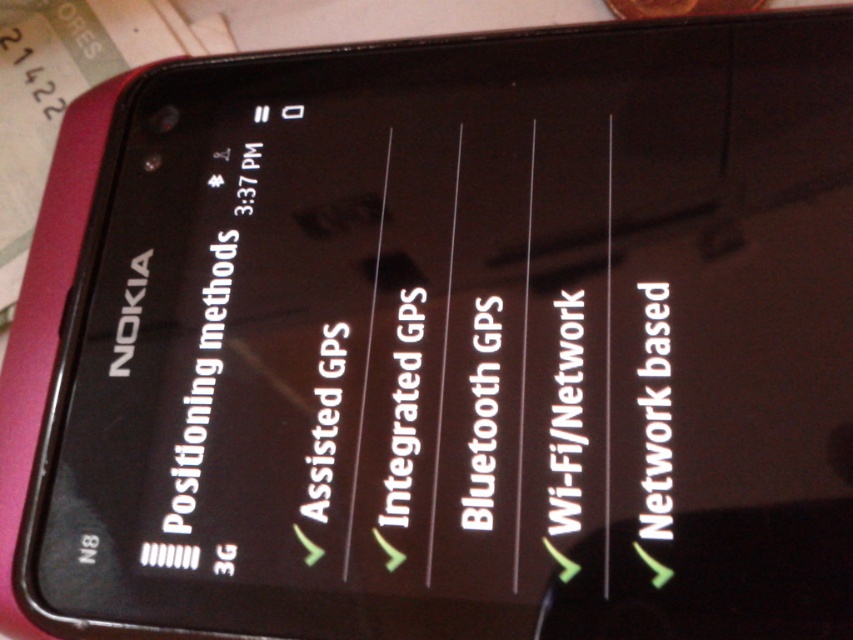
Question: Which of these objects is positioned closest to the black glossy text at center right?

Choices:
 (A) white text at center
 (B) white glossy text at center

Answer: (A)

Question: Observing the image, what is the correct spatial positioning of black glossy text at center right in reference to white text at center?

Choices:
 (A) right
 (B) left

Answer: (A)

Question: Does white text at center lie in front of white glossy text at center?

Choices:
 (A) yes
 (B) no

Answer: (A)

Question: Is white text at center wider than white glossy text at center?

Choices:
 (A) no
 (B) yes

Answer: (A)

Question: Which of the following is the closest to the observer?

Choices:
 (A) black glossy text at center right
 (B) white glossy text at center
 (C) white text at center

Answer: (A)

Question: Which object is farther from the camera taking this photo?

Choices:
 (A) black glossy text at center right
 (B) white text at center

Answer: (B)